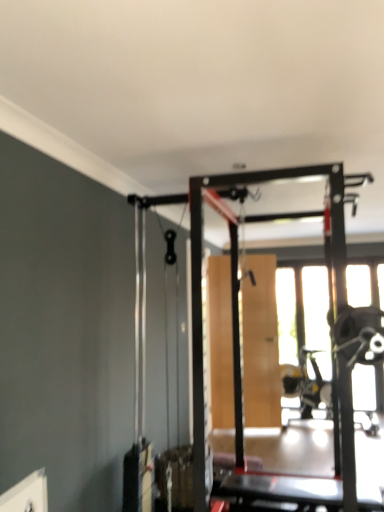
Question: Is transparent glass window at center wider than wooden screen door at center?

Choices:
 (A) no
 (B) yes

Answer: (A)

Question: Would you say wooden screen door at center is part of transparent glass window at center's contents?

Choices:
 (A) yes
 (B) no

Answer: (B)

Question: Is transparent glass window at center aimed at wooden screen door at center?

Choices:
 (A) yes
 (B) no

Answer: (B)

Question: Does transparent glass window at center lie in front of wooden screen door at center?

Choices:
 (A) no
 (B) yes

Answer: (A)

Question: Does transparent glass window at center appear on the right side of wooden screen door at center?

Choices:
 (A) no
 (B) yes

Answer: (B)

Question: Can you confirm if transparent glass window at center is smaller than wooden screen door at center?

Choices:
 (A) yes
 (B) no

Answer: (A)

Question: Considering the relative positions of wooden screen door at center and transparent glass window at center in the image provided, is wooden screen door at center in front of transparent glass window at center?

Choices:
 (A) yes
 (B) no

Answer: (A)

Question: Does wooden screen door at center appear on the left side of transparent glass window at center?

Choices:
 (A) no
 (B) yes

Answer: (B)

Question: From a real-world perspective, is wooden screen door at center positioned under transparent glass window at center based on gravity?

Choices:
 (A) yes
 (B) no

Answer: (A)

Question: Is wooden screen door at center looking in the opposite direction of transparent glass window at center?

Choices:
 (A) yes
 (B) no

Answer: (B)

Question: From a real-world perspective, is wooden screen door at center located higher than transparent glass window at center?

Choices:
 (A) no
 (B) yes

Answer: (A)

Question: Is wooden screen door at center positioned beyond the bounds of transparent glass window at center?

Choices:
 (A) no
 (B) yes

Answer: (B)

Question: In terms of width, does wooden screen door at center look wider or thinner when compared to transparent glass window at center?

Choices:
 (A) thin
 (B) wide

Answer: (B)